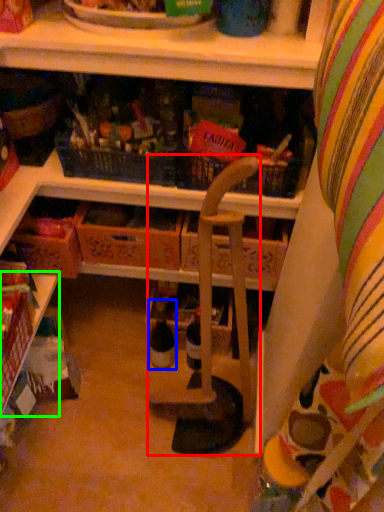
Question: Which is farther away from armchair (highlighted by a red box)? bottle (highlighted by a blue box) or shelf (highlighted by a green box)?

Choices:
 (A) bottle
 (B) shelf

Answer: (B)